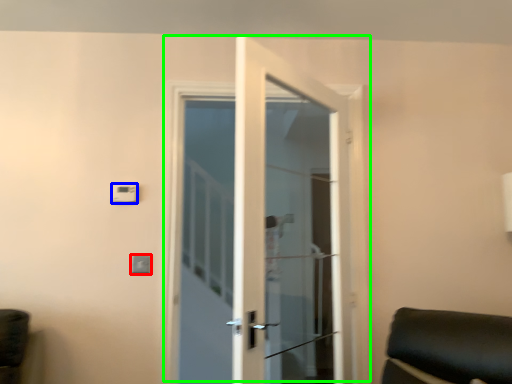
Question: Considering the real-world distances, which object is farthest from light switch (highlighted by a red box)? light switch (highlighted by a blue box) or door (highlighted by a green box)?

Choices:
 (A) light switch
 (B) door

Answer: (B)